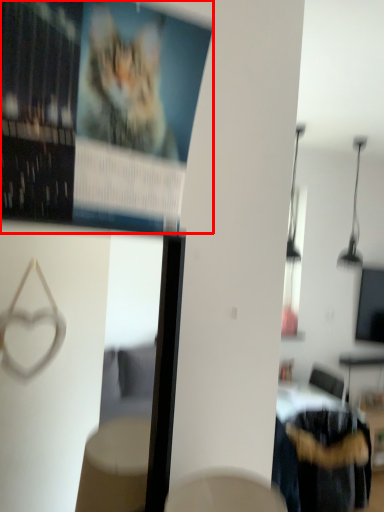
Question: Considering the relative positions of poster page (annotated by the red box) and furniture in the image provided, where is poster page (annotated by the red box) located with respect to the staircase?

Choices:
 (A) left
 (B) right

Answer: (A)